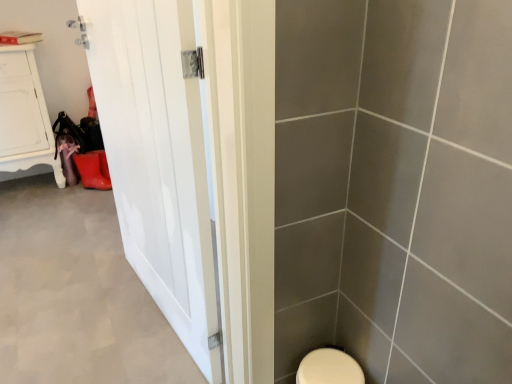
I want to click on free space between white wood cabinet at upper left and white glossy door at left, so click(79, 241).